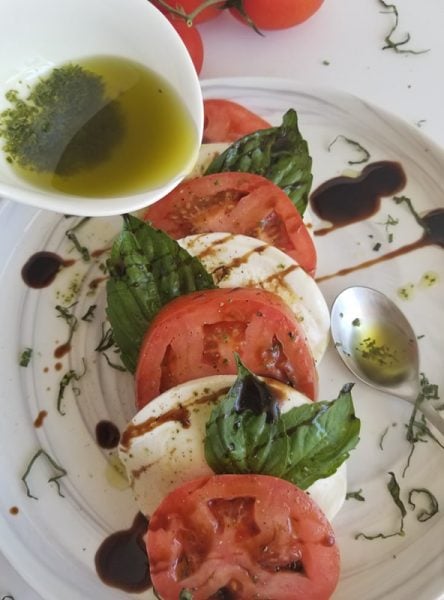
Locate an element on the screen. white plate is located at coordinates (76, 527).